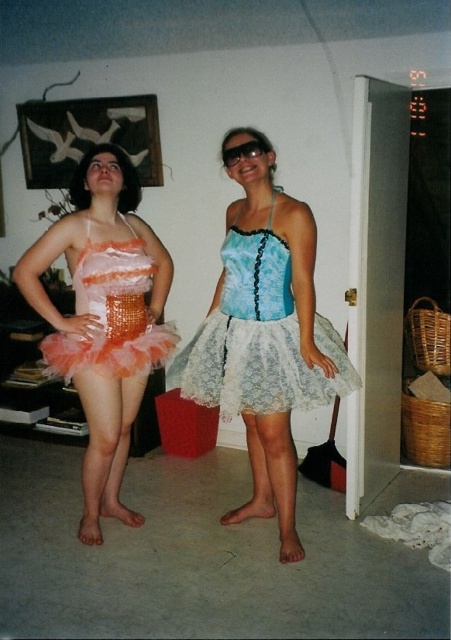
Is shiny orange sequined tutu at left to the left of black plastic goggles at upper center from the viewer's perspective?

Indeed, shiny orange sequined tutu at left is positioned on the left side of black plastic goggles at upper center.

Is shiny orange sequined tutu at left thinner than black plastic goggles at upper center?

No, shiny orange sequined tutu at left is not thinner than black plastic goggles at upper center.

In order to click on shiny orange sequined tutu at left in this screenshot , I will do `click(115, 308)`.

Find the location of `shiny orange sequined tutu at left`. shiny orange sequined tutu at left is located at coordinates (115, 308).

Does lace fabric tutu skirt at center have a greater height compared to orange sequined tutu at left?

Yes.

From the picture: Is lace fabric tutu skirt at center smaller than orange sequined tutu at left?

No.

This screenshot has width=451, height=640. Find the location of `lace fabric tutu skirt at center`. lace fabric tutu skirt at center is located at coordinates (266, 337).

I want to click on lace fabric tutu skirt at center, so click(266, 337).

Does white lace ballet skirt at center have a lesser height compared to shiny orange sequined tutu at left?

Indeed, white lace ballet skirt at center has a lesser height compared to shiny orange sequined tutu at left.

Does point (311, 384) lie behind point (106, 275)?

No, (311, 384) is in front of (106, 275).

Image resolution: width=451 pixels, height=640 pixels. I want to click on white lace ballet skirt at center, so click(258, 365).